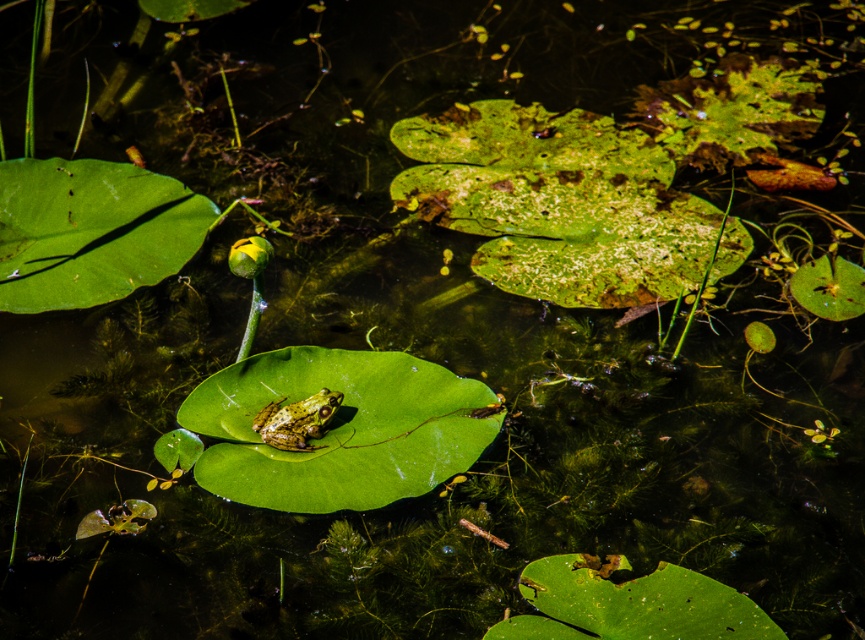
Is green matte leaf at center wider than speckled green frog at center?

Indeed, green matte leaf at center has a greater width compared to speckled green frog at center.

Is green matte leaf at center to the left of speckled green frog at center from the viewer's perspective?

In fact, green matte leaf at center is to the right of speckled green frog at center.

You are a GUI agent. You are given a task and a screenshot of the screen. Output one action in this format:
    pyautogui.click(x=<x>, y=<y>)
    Task: Click on the green matte leaf at center
    This screenshot has width=865, height=640.
    Given the screenshot: What is the action you would take?
    pyautogui.click(x=338, y=428)

Find the location of a particular element. This screenshot has height=640, width=865. green matte leaf at center is located at coordinates (338, 428).